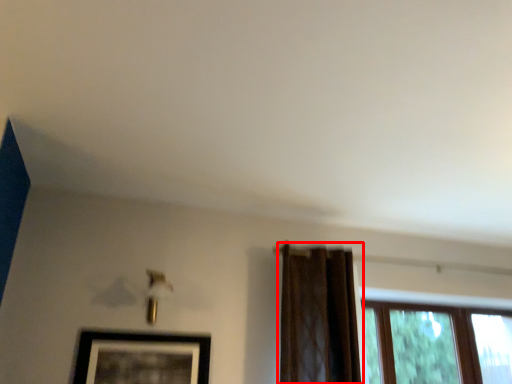
Question: Where is curtain (annotated by the red box) located in relation to picture frame in the image?

Choices:
 (A) right
 (B) left

Answer: (A)